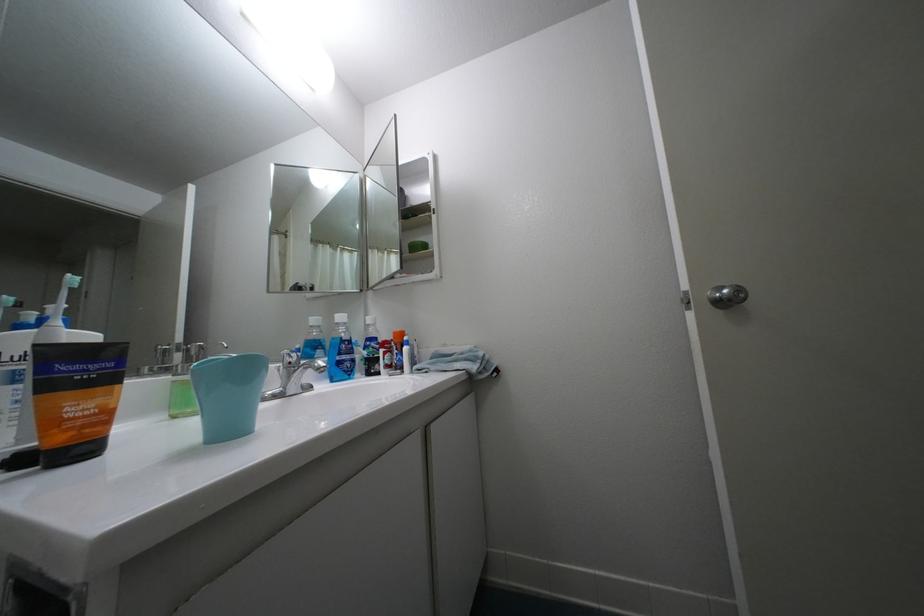
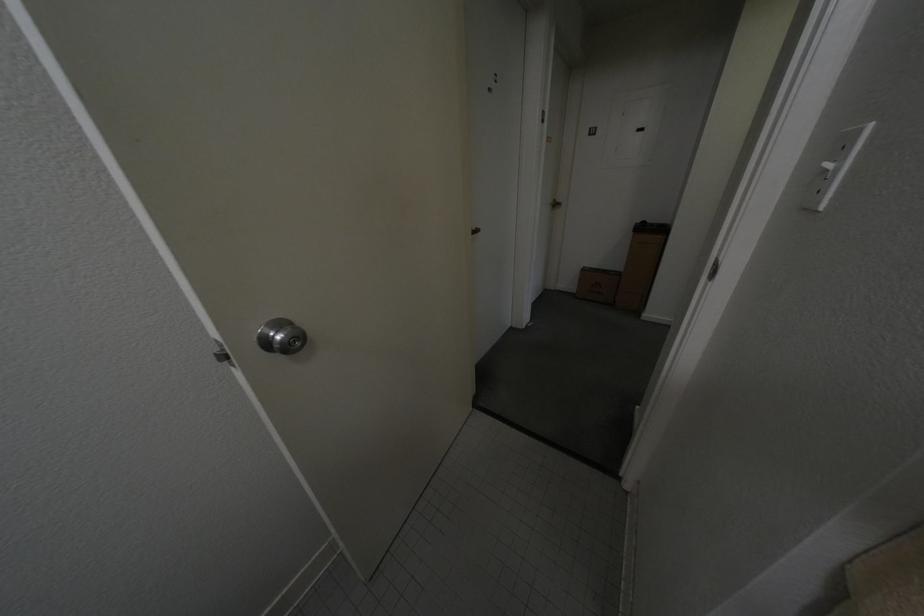
How did the camera likely rotate?

The rotation direction of the camera is right-down.